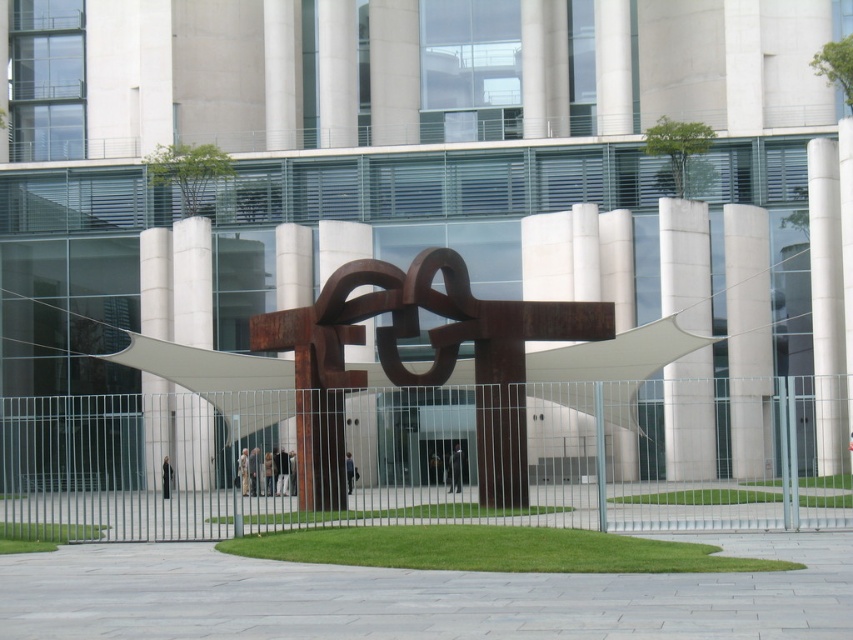
Consider the image. Is satin white column at center to the right of white smooth pillar at left from the viewer's perspective?

Correct, you'll find satin white column at center to the right of white smooth pillar at left.

Does point (669, 243) come in front of point (158, 406)?

Yes, point (669, 243) is closer to viewer.

Find the location of a particular element. This screenshot has height=640, width=853. satin white column at center is located at coordinates (685, 262).

Is point (154, 266) positioned before point (627, 429)?

No, it is behind (627, 429).

Which is behind, point (148, 464) or point (614, 460)?

The point (148, 464) is more distant.

Identify the location of white smooth pillar at left. (155, 282).

Is rusty metal sculpture at center taller than satin white column at center?

No, rusty metal sculpture at center is not taller than satin white column at center.

Is rusty metal sculpture at center positioned at the back of satin white column at center?

No, rusty metal sculpture at center is closer to the viewer.

Measure the distance between point (505, 442) and camera.

They are 133.82 feet apart.

This screenshot has width=853, height=640. Identify the location of rusty metal sculpture at center. (416, 372).